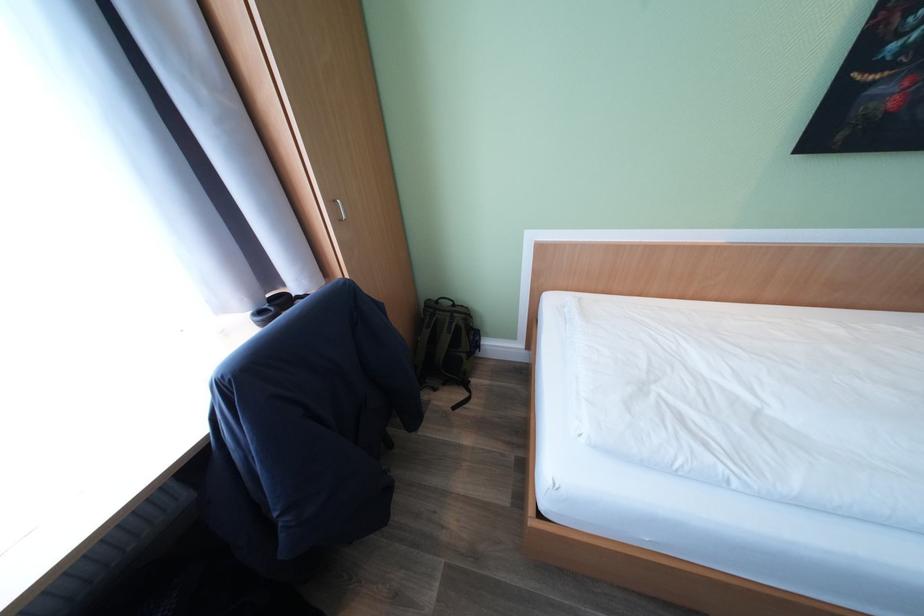
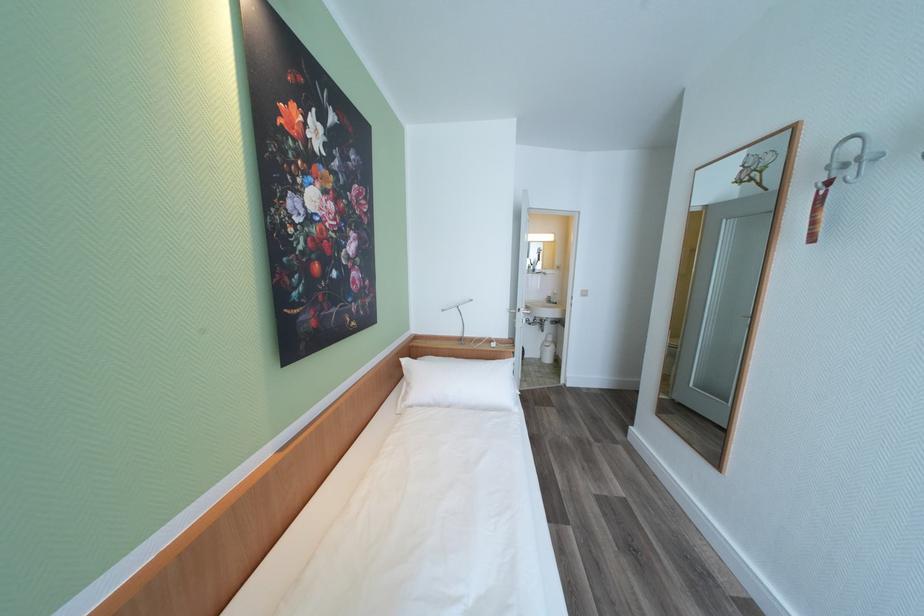
Question: The first image is from the beginning of the video and the second image is from the end. How did the camera likely rotate when shooting the video?

Choices:
 (A) Left
 (B) Right
 (C) Up
 (D) Down

Answer: (B)